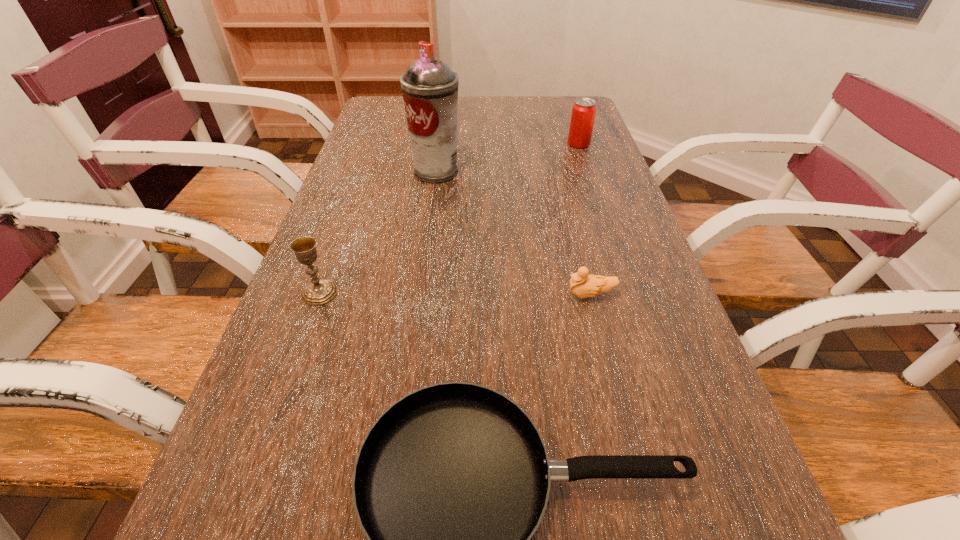
Identify the location of aerosol can. (430, 89).

Locate an element on the screen. the tallest object is located at coordinates (430, 89).

The height and width of the screenshot is (540, 960). What are the coordinates of `can` in the screenshot? It's located at (584, 109).

Locate an element on the screen. the leftmost object is located at coordinates [x=319, y=291].

Find the location of a particular element. duckling is located at coordinates (583, 285).

This screenshot has height=540, width=960. I want to click on free space located on the front of the fourth nearest object, so click(x=423, y=263).

The height and width of the screenshot is (540, 960). Find the location of `vacant space located 0.200m on the front of the farthest object`. vacant space located 0.200m on the front of the farthest object is located at coordinates (592, 186).

This screenshot has width=960, height=540. I want to click on vacant region located 0.200m on the back of the chalice, so click(345, 222).

Find the location of a particular element. The width and height of the screenshot is (960, 540). free region located 0.100m on the face of the duckling is located at coordinates (517, 295).

The image size is (960, 540). I want to click on free space located 0.280m on the face of the duckling, so click(x=428, y=295).